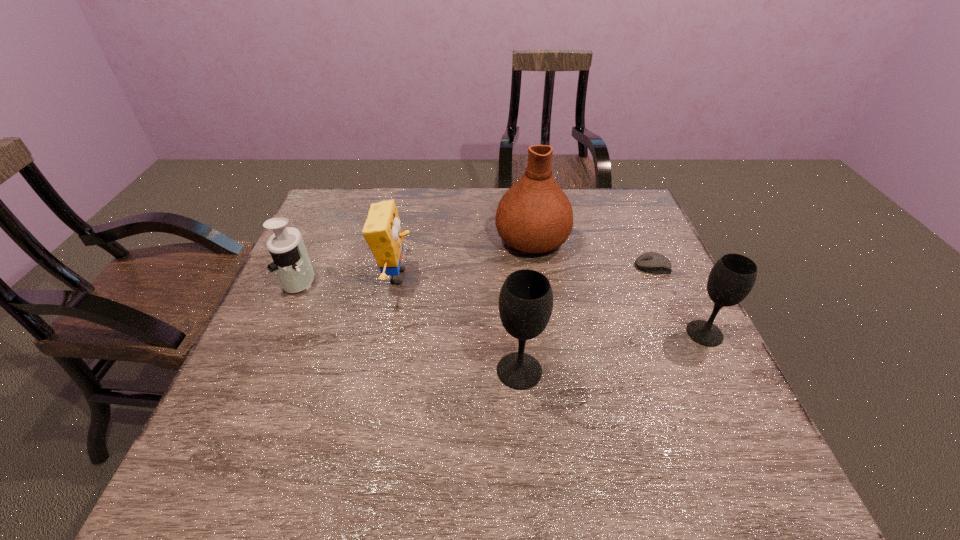
Locate an element on the screen. This screenshot has width=960, height=540. free space at the left edge of the desktop is located at coordinates (310, 244).

Identify the location of free space at the right edge of the desktop. (647, 246).

The width and height of the screenshot is (960, 540). I want to click on free space at the near left corner of the desktop, so [x=260, y=399].

I want to click on free space at the far right corner of the desktop, so click(x=609, y=192).

Locate an element on the screen. This screenshot has width=960, height=540. free space at the near right corner is located at coordinates (733, 404).

Where is `vacant area between the fifth shortest object and the sponge`? This screenshot has width=960, height=540. vacant area between the fifth shortest object and the sponge is located at coordinates (458, 324).

Locate an element on the screen. The width and height of the screenshot is (960, 540). free area in between the computer equipment and the nearer wineglass is located at coordinates (587, 319).

Where is `free space between the juicer and the shortest object`? The height and width of the screenshot is (540, 960). free space between the juicer and the shortest object is located at coordinates (476, 274).

This screenshot has height=540, width=960. I want to click on free space between the computer equipment and the nearest object, so click(x=587, y=319).

I want to click on free spot between the leftmost object and the computer equipment, so click(x=476, y=274).